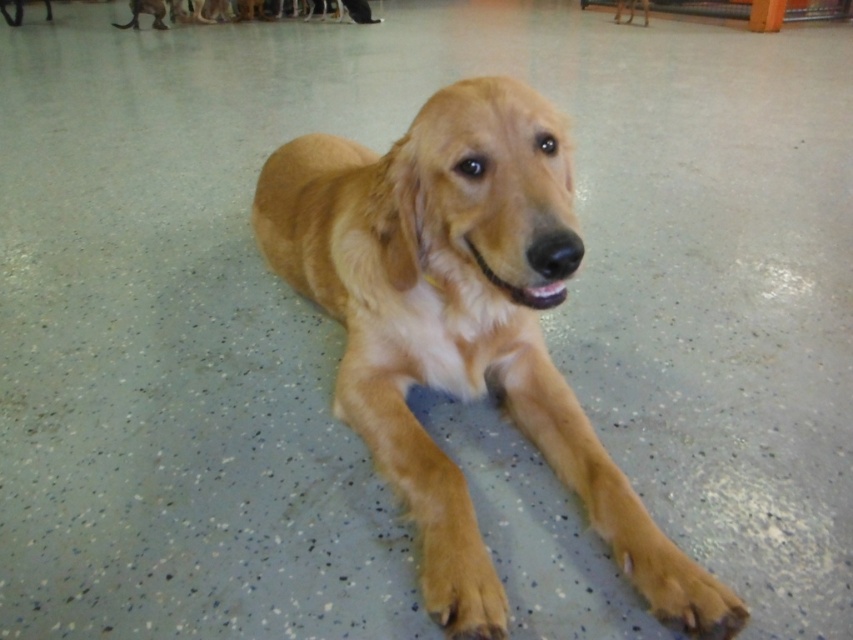
Question: Which point is closer to the camera?

Choices:
 (A) (332, 236)
 (B) (474, 572)

Answer: (B)

Question: In this image, where is golden fur dog at center located relative to golden fur paw at lower center?

Choices:
 (A) right
 (B) left

Answer: (B)

Question: Does golden fur dog at center have a greater width compared to golden fur paw at lower center?

Choices:
 (A) no
 (B) yes

Answer: (B)

Question: Which of the following is the farthest from the observer?

Choices:
 (A) (363, 337)
 (B) (421, 547)

Answer: (A)

Question: Considering the relative positions of golden fur dog at center and golden fur paw at lower center in the image provided, where is golden fur dog at center located with respect to golden fur paw at lower center?

Choices:
 (A) left
 (B) right

Answer: (A)